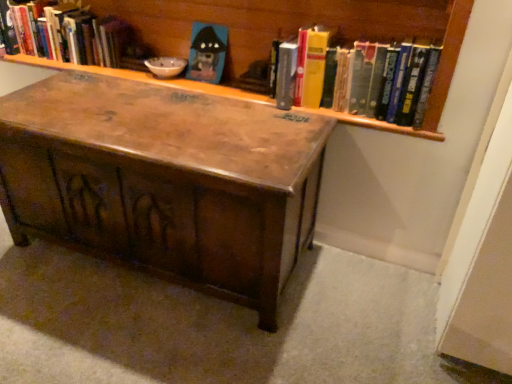
Where is `matte plastic toy at upper center`? The image size is (512, 384). matte plastic toy at upper center is located at coordinates coord(207,52).

In order to click on hardcover book at upper left, the 2th book viewed from the right in this screenshot , I will do point(66,33).

Where is `matte plastic toy at upper center`? matte plastic toy at upper center is located at coordinates tap(207, 52).

From the image's perspective, does matte plastic toy at upper center appear higher than hardcover book at upper left, the first book viewed from the left?

No.

Is matte plastic toy at upper center facing away from hardcover book at upper left, the 1th book from the back?

No, hardcover book at upper left, the 1th book from the back, is not at the back of matte plastic toy at upper center.

You are a GUI agent. You are given a task and a screenshot of the screen. Output one action in this format:
    pyautogui.click(x=<x>, y=<y>)
    Task: Click on the toy on the right side of hardcover book at upper left, positioned as the 2th book in front-to-back order
    The height and width of the screenshot is (384, 512).
    Given the screenshot: What is the action you would take?
    pyautogui.click(x=207, y=52)

Does point (225, 53) lie in front of point (47, 45)?

Yes, it is in front of point (47, 45).

Is wooden bookcase at upper center thinner than hardcover book at upper left, positioned as the 2th book in front-to-back order?

Incorrect, the width of wooden bookcase at upper center is not less than that of hardcover book at upper left, positioned as the 2th book in front-to-back order.

Can you confirm if wooden bookcase at upper center is shorter than hardcover book at upper left, the 2th book viewed from the right?

In fact, wooden bookcase at upper center may be taller than hardcover book at upper left, the 2th book viewed from the right.

Is wooden bookcase at upper center in front of or behind hardcover book at upper left, the first book viewed from the left, in the image?

In the image, wooden bookcase at upper center appears in front of hardcover book at upper left, the first book viewed from the left.

From a real-world perspective, is matte plastic toy at upper center beneath hardcover books at upper right, which is counted as the second book, starting from the back?

Yes.

From the picture: Which object is further away from the camera, matte plastic toy at upper center or hardcover books at upper right, positioned as the first book in front-to-back order?

matte plastic toy at upper center is behind.

How many degrees apart are the facing directions of matte plastic toy at upper center and hardcover books at upper right, which is the 2th book from left to right?

The angle between the facing direction of matte plastic toy at upper center and the facing direction of hardcover books at upper right, which is the 2th book from left to right, is 0.00216 degrees.

Between matte plastic toy at upper center and hardcover books at upper right, which is the 2th book from left to right, which one has larger size?

Bigger between the two is hardcover books at upper right, which is the 2th book from left to right.

Is hardcover books at upper right, which is the 2th book from left to right, outside of matte plastic toy at upper center?

Yes.

Who is smaller, hardcover books at upper right, arranged as the first book when viewed from the right, or matte plastic toy at upper center?

matte plastic toy at upper center is smaller.

Considering the relative positions of hardcover books at upper right, which is counted as the second book, starting from the back, and matte plastic toy at upper center in the image provided, is hardcover books at upper right, which is counted as the second book, starting from the back, to the left of matte plastic toy at upper center from the viewer's perspective?

No.

From a real-world perspective, starting from the matte plastic toy at upper center, which book is the 2nd one vertically above it? Please provide its 2D coordinates.

[(362, 78)]

Between hardcover book at upper left, positioned as the 2th book in front-to-back order, and wooden bookcase at upper center, which one has smaller width?

hardcover book at upper left, positioned as the 2th book in front-to-back order, is thinner.

From the image's perspective, does hardcover book at upper left, the first book viewed from the left, appear higher than wooden bookcase at upper center?

Yes, from the image's perspective, hardcover book at upper left, the first book viewed from the left, is above wooden bookcase at upper center.

Identify the location of the 2nd book positioned below the wooden bookcase at upper center (from a real-world perspective). (66, 33).

Considering the sizes of hardcover book at upper left, the first book viewed from the left, and wooden bookcase at upper center in the image, is hardcover book at upper left, the first book viewed from the left, bigger or smaller than wooden bookcase at upper center?

Considering their sizes, hardcover book at upper left, the first book viewed from the left, takes up less space than wooden bookcase at upper center.

Who is smaller, hardcover books at upper right, which is the 2th book from left to right, or wooden trunk at center?

hardcover books at upper right, which is the 2th book from left to right, is smaller.

In the image, is hardcover books at upper right, which is the 2th book from left to right, positioned in front of or behind wooden trunk at center?

Visually, hardcover books at upper right, which is the 2th book from left to right, is located behind wooden trunk at center.

Who is shorter, hardcover books at upper right, which is the 2th book from left to right, or wooden trunk at center?

Standing shorter between the two is hardcover books at upper right, which is the 2th book from left to right.

Is there a large distance between hardcover books at upper right, arranged as the first book when viewed from the right, and wooden trunk at center?

No, hardcover books at upper right, arranged as the first book when viewed from the right, is not far away from wooden trunk at center.

From a real-world perspective, is hardcover books at upper right, which is the 2th book from left to right, on top of wooden bookcase at upper center?

No, from a real-world perspective, hardcover books at upper right, which is the 2th book from left to right, is not on top of wooden bookcase at upper center.

From the image's perspective, which one is positioned lower, hardcover books at upper right, which is the 2th book from left to right, or wooden bookcase at upper center?

From the image's view, hardcover books at upper right, which is the 2th book from left to right, is below.

Is hardcover books at upper right, arranged as the first book when viewed from the right, at the left side of wooden bookcase at upper center?

No, hardcover books at upper right, arranged as the first book when viewed from the right, is not to the left of wooden bookcase at upper center.

Where is `book to the left of matte plastic toy at upper center`? book to the left of matte plastic toy at upper center is located at coordinates (66, 33).

In order to click on bookcase in front of the hardcover book at upper left, the 2th book viewed from the right in this screenshot , I will do `click(432, 86)`.

Looking at the image, which one is located further to wooden bookcase at upper center, wooden trunk at center or matte plastic toy at upper center?

wooden trunk at center lies further to wooden bookcase at upper center than the other object.

When comparing their distances from wooden trunk at center, does wooden bookcase at upper center or hardcover books at upper right, which is counted as the second book, starting from the back, seem closer?

wooden bookcase at upper center.

Considering their positions, is matte plastic toy at upper center positioned closer to wooden trunk at center than hardcover book at upper left, the 2th book viewed from the right?

matte plastic toy at upper center is positioned closer to the anchor wooden trunk at center.

Considering their positions, is matte plastic toy at upper center positioned further to wooden trunk at center than hardcover books at upper right, arranged as the first book when viewed from the right?

matte plastic toy at upper center is positioned further to the anchor wooden trunk at center.

Based on their spatial positions, is hardcover book at upper left, the first book viewed from the left, or matte plastic toy at upper center further from wooden bookcase at upper center?

hardcover book at upper left, the first book viewed from the left, is positioned further to the anchor wooden bookcase at upper center.

Estimate the real-world distances between objects in this image. Which object is closer to matte plastic toy at upper center, hardcover books at upper right, positioned as the first book in front-to-back order, or wooden trunk at center?

hardcover books at upper right, positioned as the first book in front-to-back order, is positioned closer to the anchor matte plastic toy at upper center.

Based on the photo, which object lies nearer to the anchor point matte plastic toy at upper center, wooden trunk at center or hardcover books at upper right, arranged as the first book when viewed from the right?

Based on the image, hardcover books at upper right, arranged as the first book when viewed from the right, appears to be nearer to matte plastic toy at upper center.

Consider the image. Looking at the image, which one is located closer to hardcover books at upper right, arranged as the first book when viewed from the right, hardcover book at upper left, positioned as the 2th book in front-to-back order, or wooden trunk at center?

wooden trunk at center is closer to hardcover books at upper right, arranged as the first book when viewed from the right.

Locate an element on the screen. bookcase between hardcover book at upper left, the 2th book viewed from the right, and wooden trunk at center, in the vertical direction is located at coordinates (432, 86).

This screenshot has height=384, width=512. I want to click on toy between wooden bookcase at upper center and wooden trunk at center from top to bottom, so click(x=207, y=52).

Locate an element on the screen. The height and width of the screenshot is (384, 512). toy between wooden trunk at center and hardcover books at upper right, which is counted as the second book, starting from the back, in the horizontal direction is located at coordinates (207, 52).

This screenshot has height=384, width=512. What are the coordinates of `table located between hardcover book at upper left, the first book viewed from the left, and hardcover books at upper right, which is the 2th book from left to right, in the left-right direction` in the screenshot? It's located at (164, 179).